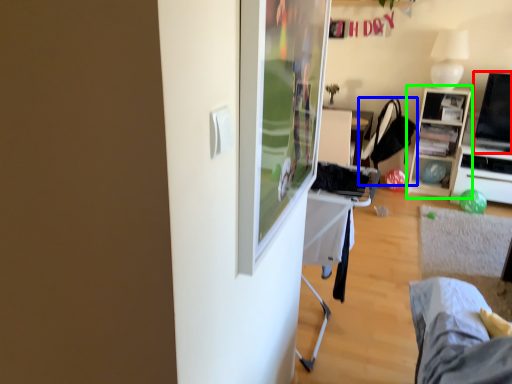
Question: Which object is positioned farthest from television (highlighted by a red box)? Select from chair (highlighted by a blue box) and cabinetry (highlighted by a green box).

Choices:
 (A) chair
 (B) cabinetry

Answer: (A)